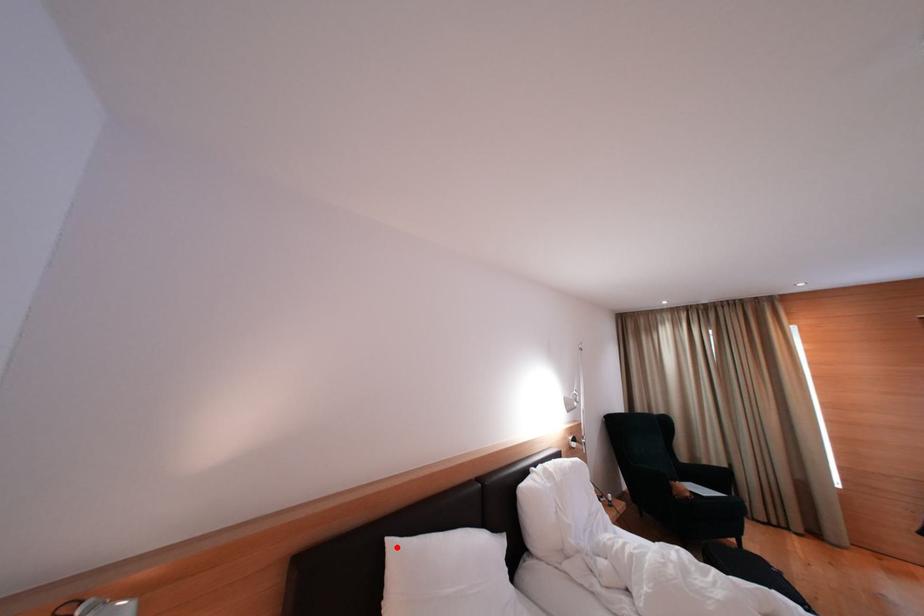
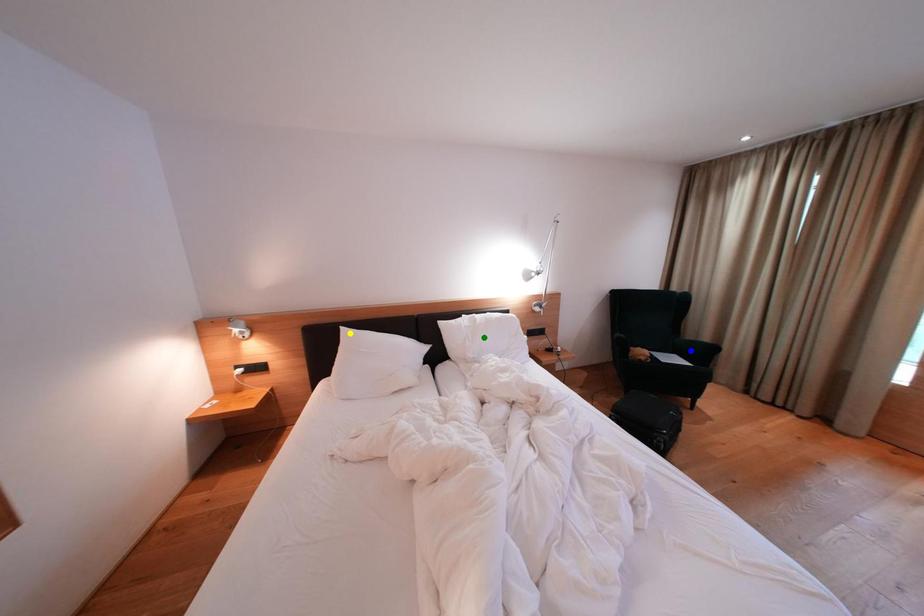
Question: I am providing you with two images of the same scene from different viewpoints. A red point is marked on the first image. You are given multiple points on the second image. Which point in image 2 is actually the same real-world point as the red point in image 1?

Choices:
 (A) green point
 (B) yellow point
 (C) blue point

Answer: (B)